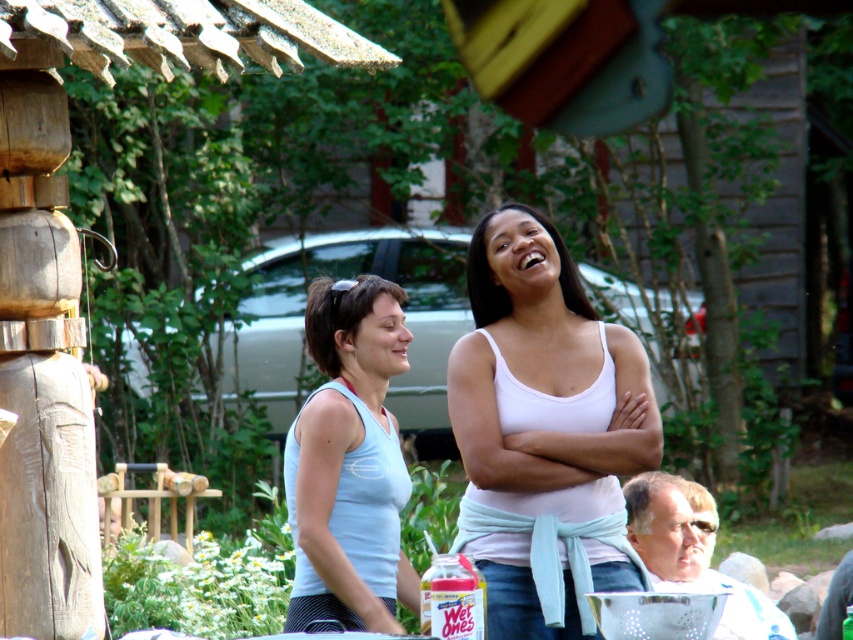
Question: Which object is farther from the camera taking this photo?

Choices:
 (A) light blue fabric tank top at center
 (B) white matte tank top at center

Answer: (A)

Question: Which object is farther from the camera taking this photo?

Choices:
 (A) light blue fabric tank top at center
 (B) white matte tank top at center

Answer: (A)

Question: Does white matte tank top at center come behind light blue fabric tank top at center?

Choices:
 (A) yes
 (B) no

Answer: (B)

Question: Is white matte tank top at center positioned before light blue fabric tank top at center?

Choices:
 (A) no
 (B) yes

Answer: (B)

Question: Considering the relative positions of white matte tank top at center and light blue fabric tank top at center in the image provided, where is white matte tank top at center located with respect to light blue fabric tank top at center?

Choices:
 (A) below
 (B) above

Answer: (B)

Question: Which of the following is the closest to the observer?

Choices:
 (A) white matte tank top at center
 (B) light blue fabric tank top at center

Answer: (A)